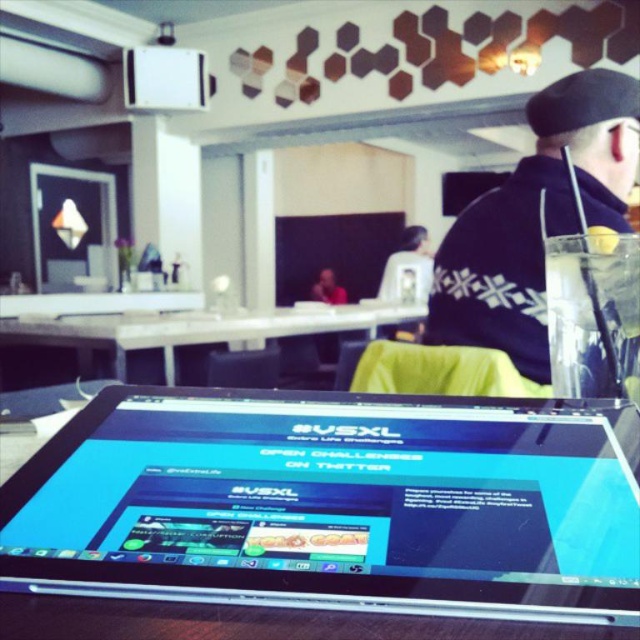
Is silver metallic tablet at center taller than smooth skin person at center?

In fact, silver metallic tablet at center may be shorter than smooth skin person at center.

Between silver metallic tablet at center and smooth skin person at center, which one appears on the left side from the viewer's perspective?

From the viewer's perspective, smooth skin person at center appears more on the left side.

This screenshot has height=640, width=640. Describe the element at coordinates (333, 504) in the screenshot. I see `silver metallic tablet at center` at that location.

At what (x,y) coordinates should I click in order to perform the action: click on silver metallic tablet at center. Please return your answer as a coordinate pair (x, y). This screenshot has height=640, width=640. Looking at the image, I should click on (333, 504).

In the scene shown: Who is shorter, dark blue sweater at upper right or white glossy table at center?

Standing shorter between the two is white glossy table at center.

Which is behind, point (547, 179) or point (10, 340)?

The point (10, 340) is behind.

Is point (531, 348) more distant than point (413, 308)?

No, (531, 348) is in front of (413, 308).

The image size is (640, 640). Identify the location of dark blue sweater at upper right. (536, 218).

This screenshot has height=640, width=640. What do you see at coordinates (333, 504) in the screenshot?
I see `silver metallic tablet at center` at bounding box center [333, 504].

Is silver metallic tablet at center below white glossy table at center?

Yes.

Consider the image. Who is more forward, (595,429) or (125,326)?

Point (595,429) is in front.

At what (x,y) coordinates should I click in order to perform the action: click on silver metallic tablet at center. Please return your answer as a coordinate pair (x, y). Image resolution: width=640 pixels, height=640 pixels. Looking at the image, I should click on pyautogui.click(x=333, y=504).